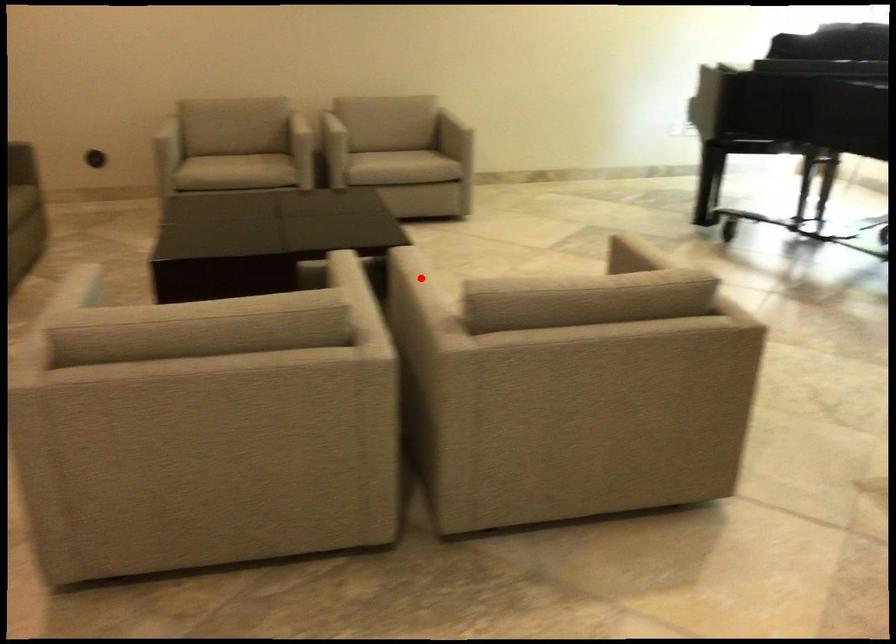
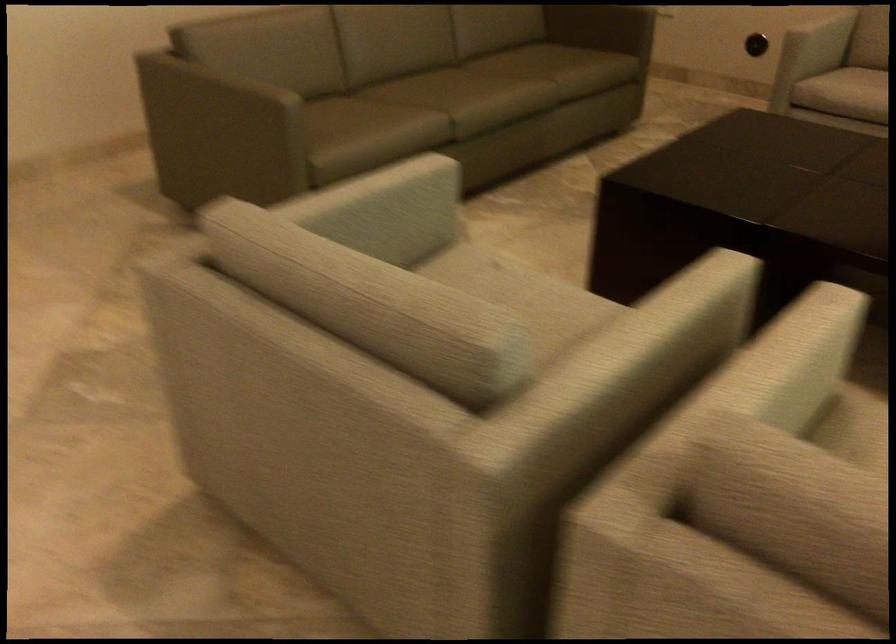
In the second image, find the point that corresponds to the highlighted location in the first image.

(782, 366)